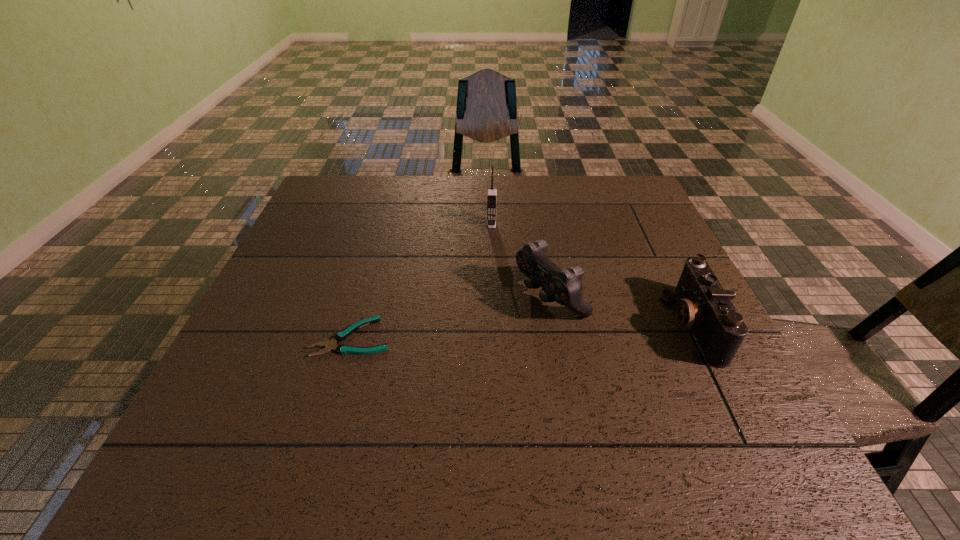
In order to click on free space located on the surface of the second object from right to left with buttons in this screenshot , I will do `click(415, 368)`.

At what (x,y) coordinates should I click in order to perform the action: click on vacant space positioned on the surface of the second object from right to left with buttons. Please return your answer as a coordinate pair (x, y). The image size is (960, 540). Looking at the image, I should click on (452, 349).

Locate an element on the screen. free space located 0.300m on the surface of the second object from right to left with buttons is located at coordinates (406, 373).

Find the location of a particular element. vacant space located on the front-facing side of the farthest object is located at coordinates (489, 333).

Where is `free spot located 0.310m on the front-facing side of the farthest object`? free spot located 0.310m on the front-facing side of the farthest object is located at coordinates (490, 305).

Where is `free region located 0.090m on the front-facing side of the farthest object`? free region located 0.090m on the front-facing side of the farthest object is located at coordinates (491, 248).

Identify the location of object that is positioned at the left edge. click(x=340, y=336).

The height and width of the screenshot is (540, 960). Find the location of `object that is at the right edge`. object that is at the right edge is located at coordinates (704, 305).

You are a GUI agent. You are given a task and a screenshot of the screen. Output one action in this format:
    pyautogui.click(x=<x>, y=<y>)
    Task: Click on the vacant region at the far edge of the desktop
    The image size is (960, 540).
    Given the screenshot: What is the action you would take?
    pyautogui.click(x=524, y=188)

In the image, there is a desktop. In order to click on vacant space at the left edge in this screenshot , I will do `click(315, 219)`.